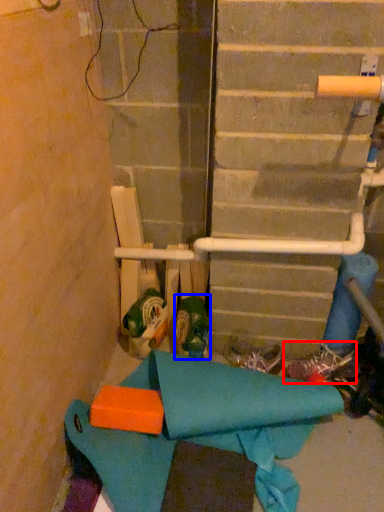
Question: Which of the following is the farthest to the observer, footwear (highlighted by a red box) or footwear (highlighted by a blue box)?

Choices:
 (A) footwear
 (B) footwear

Answer: (A)